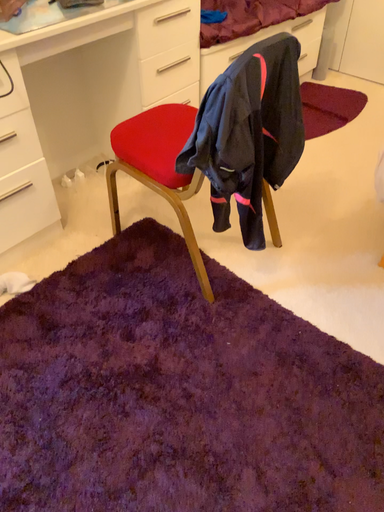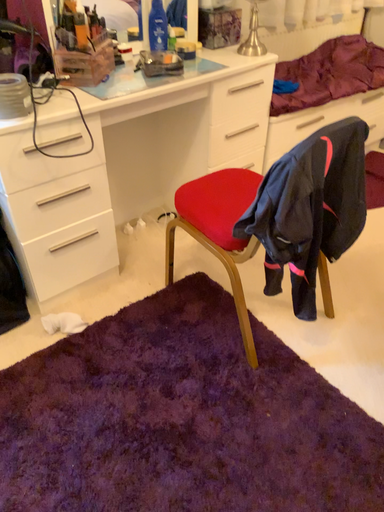
Question: Which way did the camera rotate in the video?

Choices:
 (A) rotated downward
 (B) rotated upward

Answer: (B)